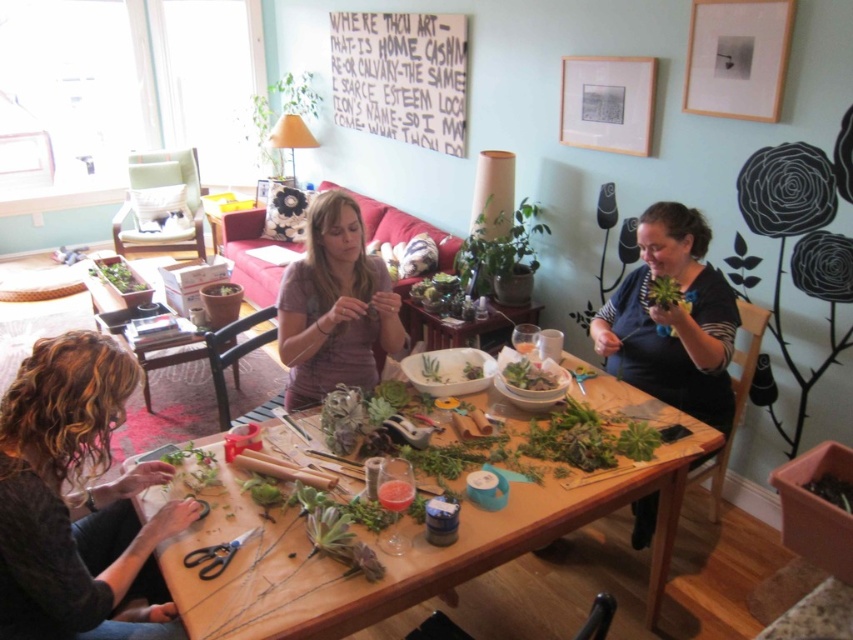
Can you confirm if wooden table at center is positioned above black plastic scissors at lower left?

Incorrect, wooden table at center is not positioned above black plastic scissors at lower left.

Does point (305, 637) come closer to viewer compared to point (184, 557)?

Yes, it is in front of point (184, 557).

At what (x,y) coordinates should I click in order to perform the action: click on wooden table at center. Please return your answer as a coordinate pair (x, y). Looking at the image, I should click on (413, 541).

Is green leafy salad at center to the right of green succulent at center from the viewer's perspective?

Correct, you'll find green leafy salad at center to the right of green succulent at center.

Measure the distance between point [515,384] and camera.

Point [515,384] is 7.01 feet away from camera.

Locate an element on the screen. Image resolution: width=853 pixels, height=640 pixels. green leafy salad at center is located at coordinates pyautogui.click(x=531, y=374).

Does green leafy salad at center have a lesser height compared to black plastic scissors at lower left?

In fact, green leafy salad at center may be taller than black plastic scissors at lower left.

Is green leafy salad at center smaller than black plastic scissors at lower left?

Actually, green leafy salad at center might be larger than black plastic scissors at lower left.

The image size is (853, 640). In order to click on green leafy salad at center in this screenshot , I will do `click(531, 374)`.

Locate an element on the screen. green leafy salad at center is located at coordinates (x=531, y=374).